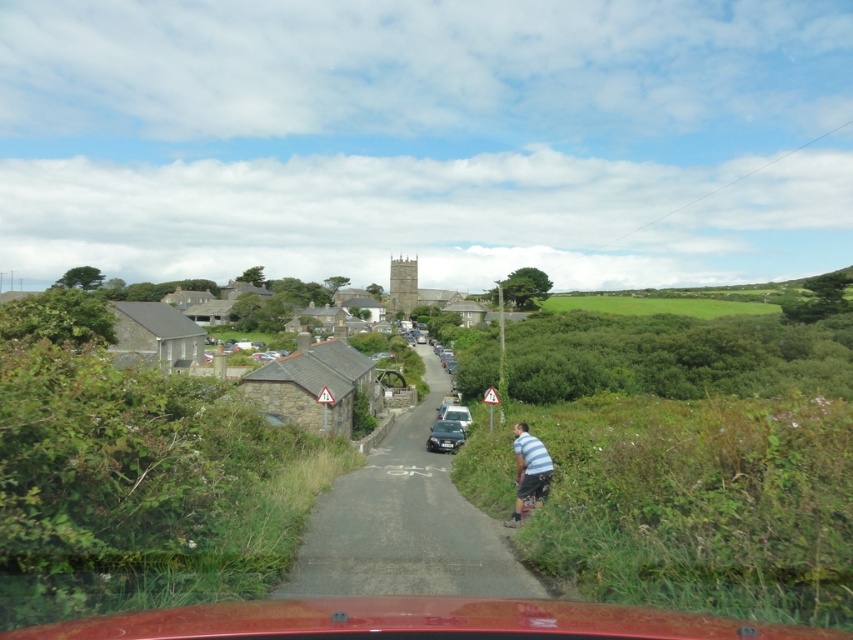
Does point (537, 452) come farther from viewer compared to point (466, 426)?

That is False.

Between striped cotton shirt at lower right and satin silver car at center, which one is positioned higher?

Positioned higher is striped cotton shirt at lower right.

Who is more forward, (x=541, y=502) or (x=467, y=413)?

Point (x=541, y=502) is in front.

You are a GUI agent. You are given a task and a screenshot of the screen. Output one action in this format:
    pyautogui.click(x=<x>, y=<y>)
    Task: Click on the striped cotton shirt at lower right
    The image size is (853, 640).
    Given the screenshot: What is the action you would take?
    pyautogui.click(x=529, y=470)

Is asphalt road at center behind striped cotton shirt at lower right?

That is False.

Can you confirm if asphalt road at center is smaller than striped cotton shirt at lower right?

No, asphalt road at center is not smaller than striped cotton shirt at lower right.

You are a GUI agent. You are given a task and a screenshot of the screen. Output one action in this format:
    pyautogui.click(x=<x>, y=<y>)
    Task: Click on the asphalt road at center
    The image size is (853, 640).
    Given the screenshot: What is the action you would take?
    click(x=404, y=524)

How distant is asphalt road at center from shiny silver car at center?

A distance of 3.94 meters exists between asphalt road at center and shiny silver car at center.

Which is in front, point (404, 525) or point (450, 442)?

Point (404, 525) is more forward.

I want to click on asphalt road at center, so click(x=404, y=524).